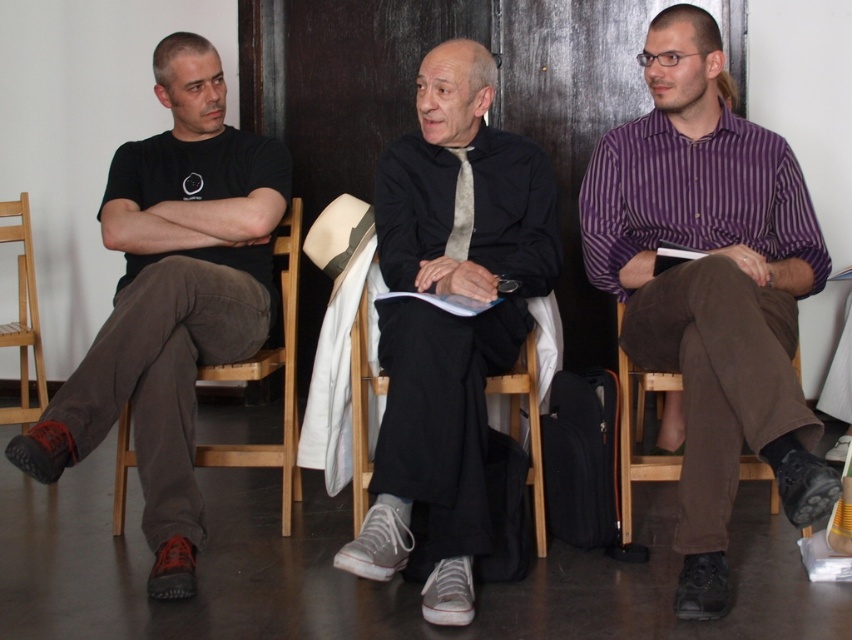
Question: Which object is positioned farthest from the light brown wooden chair at left?

Choices:
 (A) brown fabric chair at right
 (B) black matte shirt at center
 (C) wooden chair at left
 (D) matte black t-shirt at left

Answer: (A)

Question: Does brown fabric chair at right appear on the right side of gray textured tie at center?

Choices:
 (A) no
 (B) yes

Answer: (B)

Question: Can you confirm if wooden chair at left is thinner than wooden chair at center?

Choices:
 (A) yes
 (B) no

Answer: (B)

Question: Which of these objects is positioned farthest from the wooden chair at center?

Choices:
 (A) black matte shirt at center
 (B) brown fabric chair at right

Answer: (B)

Question: Which point is farther to the camera?

Choices:
 (A) click(x=38, y=353)
 (B) click(x=281, y=506)

Answer: (A)

Question: Does light brown wooden chair at left appear on the left side of gray textured tie at center?

Choices:
 (A) yes
 (B) no

Answer: (A)